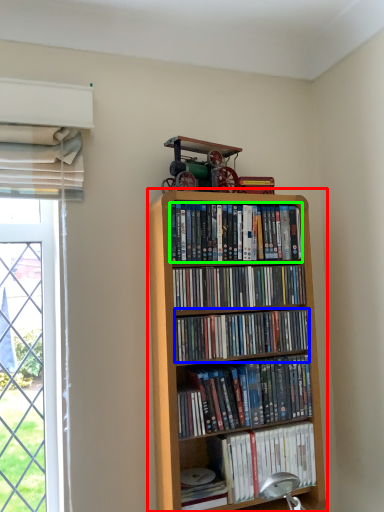
Question: Which object is the closest to the bookcase (highlighted by a red box)? Choose among these: book (highlighted by a blue box) or book (highlighted by a green box).

Choices:
 (A) book
 (B) book

Answer: (A)